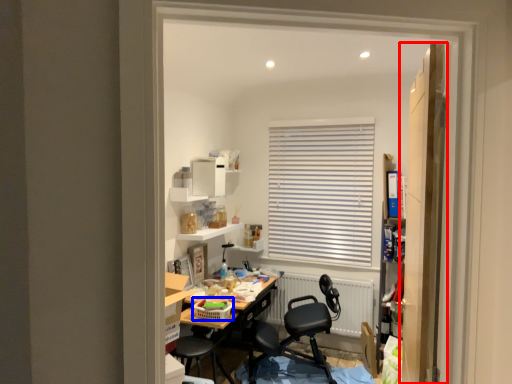
Question: Which object is closer to the camera taking this photo, door (highlighted by a red box) or laundry basket (highlighted by a blue box)?

Choices:
 (A) door
 (B) laundry basket

Answer: (A)